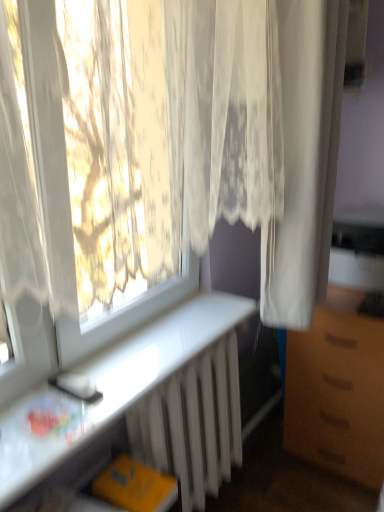
Question: Is brown matte cabinet at right looking in the opposite direction of white metallic radiator at lower center?

Choices:
 (A) no
 (B) yes

Answer: (A)

Question: Can you confirm if brown matte cabinet at right is shorter than white metallic radiator at lower center?

Choices:
 (A) no
 (B) yes

Answer: (A)

Question: Does brown matte cabinet at right lie behind white metallic radiator at lower center?

Choices:
 (A) no
 (B) yes

Answer: (B)

Question: Considering the relative sizes of brown matte cabinet at right and white metallic radiator at lower center in the image provided, is brown matte cabinet at right smaller than white metallic radiator at lower center?

Choices:
 (A) no
 (B) yes

Answer: (A)

Question: Is brown matte cabinet at right not near white metallic radiator at lower center?

Choices:
 (A) no
 (B) yes

Answer: (A)

Question: Considering the positions of white metallic radiator at lower center and white sheer curtain at right, positioned as the 1th curtain in right-to-left order, in the image, is white metallic radiator at lower center wider or thinner than white sheer curtain at right, positioned as the 1th curtain in right-to-left order,?

Choices:
 (A) thin
 (B) wide

Answer: (A)

Question: Looking at the image, does white metallic radiator at lower center seem bigger or smaller compared to white sheer curtain at right, positioned as the second curtain in left-to-right order?

Choices:
 (A) small
 (B) big

Answer: (A)

Question: Relative to white sheer curtain at right, positioned as the 1th curtain in right-to-left order, is white metallic radiator at lower center in front or behind?

Choices:
 (A) front
 (B) behind

Answer: (B)

Question: Considering the positions of point (228, 332) and point (319, 124), is point (228, 332) closer or farther from the camera than point (319, 124)?

Choices:
 (A) closer
 (B) farther

Answer: (B)

Question: From a real-world perspective, is white glossy desk at lower left physically located above or below white metallic radiator at lower center?

Choices:
 (A) below
 (B) above

Answer: (B)

Question: From the image's perspective, is white glossy desk at lower left above or below white metallic radiator at lower center?

Choices:
 (A) above
 (B) below

Answer: (A)

Question: Choose the correct answer: Is white glossy desk at lower left inside white metallic radiator at lower center or outside it?

Choices:
 (A) outside
 (B) inside

Answer: (A)

Question: Considering the positions of white glossy desk at lower left and white metallic radiator at lower center in the image, is white glossy desk at lower left bigger or smaller than white metallic radiator at lower center?

Choices:
 (A) small
 (B) big

Answer: (A)

Question: Is point (215, 36) positioned closer to the camera than point (327, 77)?

Choices:
 (A) farther
 (B) closer

Answer: (B)

Question: In terms of width, does white lace curtain at upper left, acting as the second curtain starting from the right, look wider or thinner when compared to white sheer curtain at right, positioned as the second curtain in left-to-right order?

Choices:
 (A) thin
 (B) wide

Answer: (A)